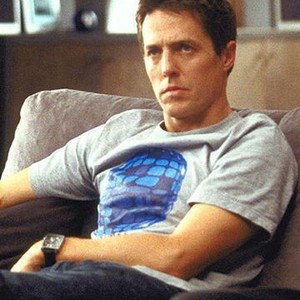
You are a GUI agent. You are given a task and a screenshot of the screen. Output one action in this format:
    pyautogui.click(x=<x>, y=<y>)
    Task: Click on the gray wall
    The image size is (300, 300).
    Given the screenshot: What is the action you would take?
    pyautogui.click(x=256, y=10)